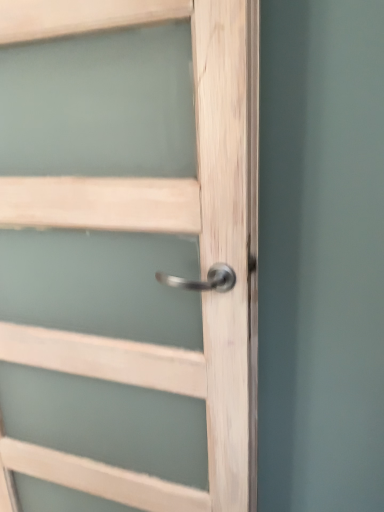
Image resolution: width=384 pixels, height=512 pixels. Identify the location of natural wood door handle at center. (159, 231).

This screenshot has height=512, width=384. Describe the element at coordinates (159, 231) in the screenshot. I see `natural wood door handle at center` at that location.

Locate an element on the screen. This screenshot has width=384, height=512. natural wood door handle at center is located at coordinates (159, 231).